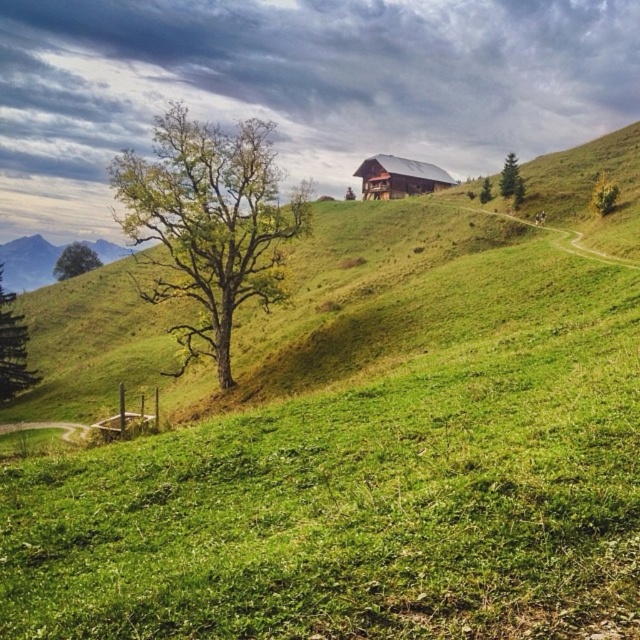
You are standing at the point marked by the coordinates point [208,224]. Looking around, you see the green leafy tree at center. What is the nearest object to your current position?

The nearest object to your current position at point [208,224] is the green leafy tree at center, as the coordinates indicate its location.

You are an architect designing a new garden layout. You need to place a new bench in the lower left corner of the image. Considering the placement of the green leafy tree at upper right, which direction should you orient the bench to ensure it faces away from the tree?

The green leafy tree at upper right is located at point (604, 195), which is in the upper right area of the image. To orient the bench in the lower left corner to face away from the tree, you should position it to face towards the lower left direction, opposite the tree.